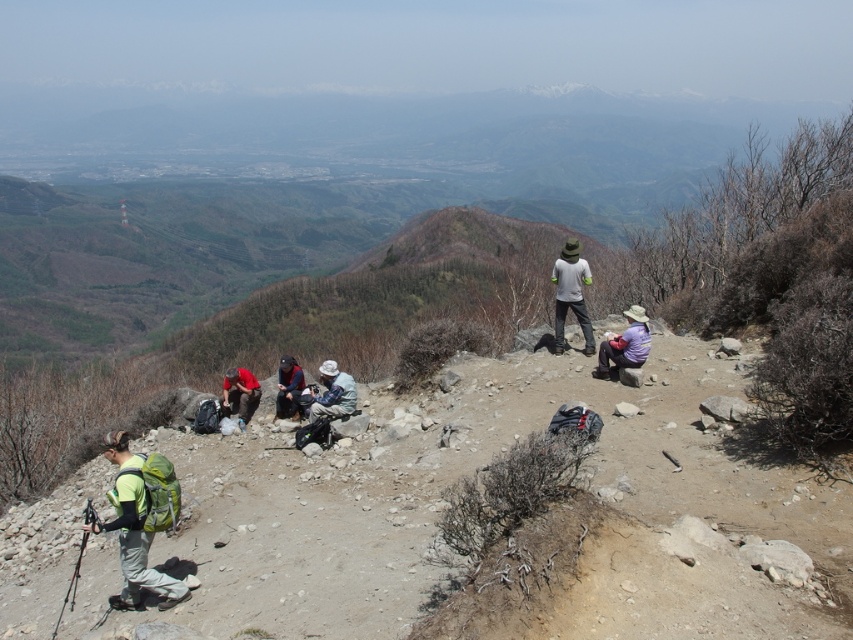
Who is more distant from viewer, (561, 298) or (256, 396)?

Positioned behind is point (256, 396).

You are a GUI agent. You are given a task and a screenshot of the screen. Output one action in this format:
    pyautogui.click(x=<x>, y=<y>)
    Task: Click on the light gray fabric jacket at upper center
    
    Given the screenshot: What is the action you would take?
    pyautogui.click(x=572, y=294)

Where is `light gray fabric jacket at upper center`? The width and height of the screenshot is (853, 640). light gray fabric jacket at upper center is located at coordinates (572, 294).

Which is behind, point (637, 310) or point (259, 396)?

The point (259, 396) is more distant.

Between point (621, 364) and point (239, 406), which one is positioned in front?

Point (621, 364) is more forward.

Between point (624, 358) and point (228, 387), which one is positioned behind?

Positioned behind is point (228, 387).

Where is `purple fabric hat at lower right`? This screenshot has height=640, width=853. purple fabric hat at lower right is located at coordinates [x=624, y=344].

How far apart are light gray fabric hat at center and red fabric shirt at center?

A distance of 3.19 meters exists between light gray fabric hat at center and red fabric shirt at center.

Is light gray fabric hat at center in front of red fabric shirt at center?

Yes.

Find the location of a particular element. light gray fabric hat at center is located at coordinates (332, 394).

At what (x,y) coordinates should I click in order to perform the action: click on light gray fabric hat at center. Please return your answer as a coordinate pair (x, y). This screenshot has height=640, width=853. Looking at the image, I should click on (332, 394).